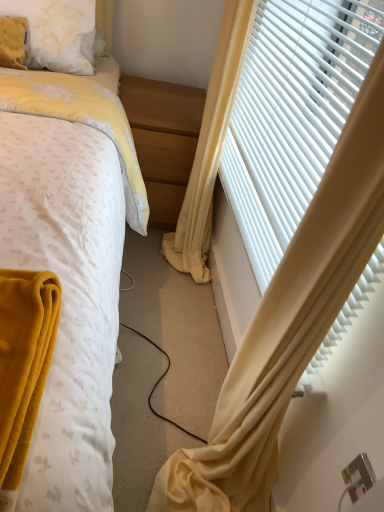
At what (x,y) coordinates should I click in order to perform the action: click on vacant area situated below white plastic blinds at right (from a real-world perspective). Please return your answer as a coordinate pair (x, y). This screenshot has height=512, width=384. Looking at the image, I should click on (218, 328).